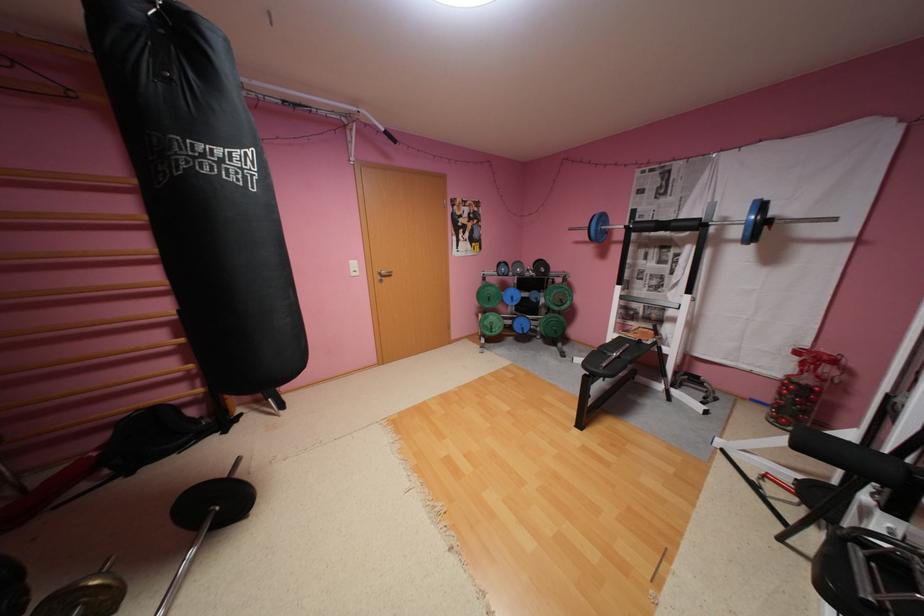
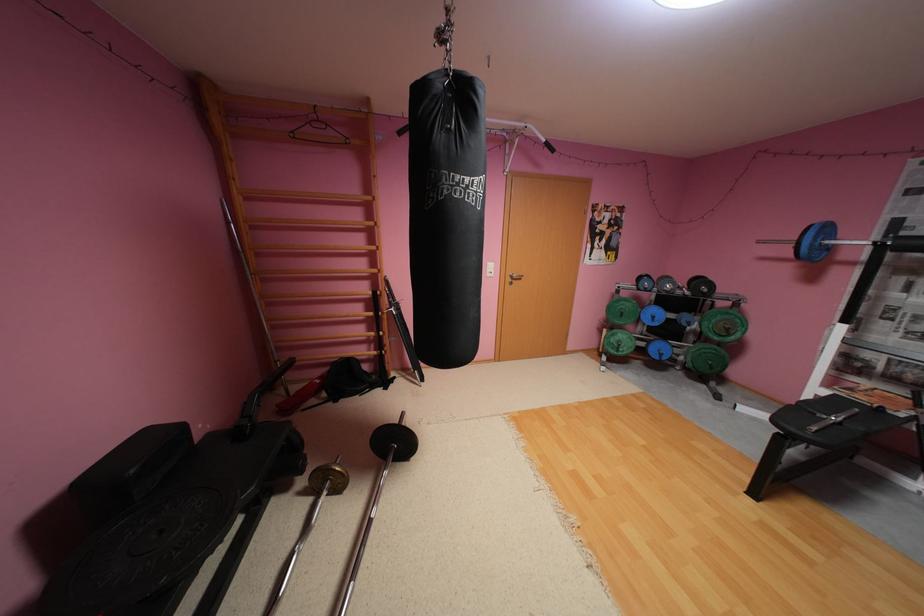
Question: Based on the continuous images, in which direction is the camera rotating? Reply with the corresponding letter.

Choices:
 (A) Left
 (B) Right
 (C) Up
 (D) Down

Answer: (A)